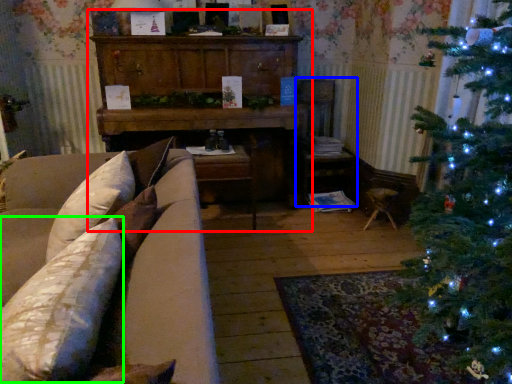
Question: Estimate the real-world distances between objects in this image. Which object is farther from dresser (highlighted by a red box), armchair (highlighted by a blue box) or pillow (highlighted by a green box)?

Choices:
 (A) armchair
 (B) pillow

Answer: (B)